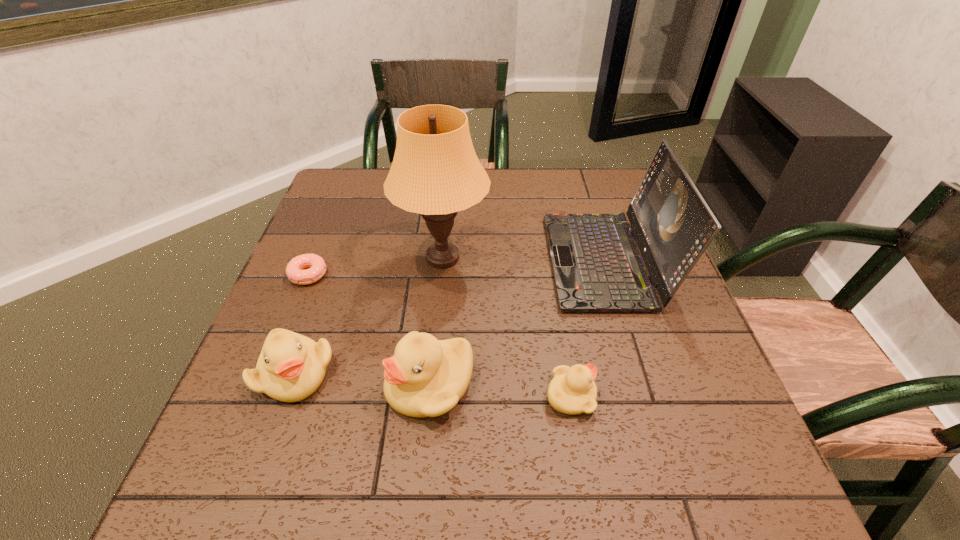
Identify the location of object that is at the near left corner. Image resolution: width=960 pixels, height=540 pixels. (291, 367).

This screenshot has width=960, height=540. In the image, there is a desktop. Find the location of `vacant space at the far edge`. vacant space at the far edge is located at coordinates (575, 183).

Locate an element on the screen. This screenshot has width=960, height=540. free space at the left edge is located at coordinates (360, 228).

This screenshot has width=960, height=540. Find the location of `vacant space at the right edge`. vacant space at the right edge is located at coordinates (663, 357).

Where is `vacant point at the far left corner`? vacant point at the far left corner is located at coordinates (371, 183).

The image size is (960, 540). Find the location of `free region at the near left corner`. free region at the near left corner is located at coordinates (283, 429).

You are a GUI agent. You are given a task and a screenshot of the screen. Output one action in this format:
    pyautogui.click(x=<x>, y=<y>)
    Task: Click on the free space that is in between the second tallest duckling and the second duckling from right to left
    
    Given the screenshot: What is the action you would take?
    pyautogui.click(x=363, y=379)

Identify the location of empty space between the second duckling from right to left and the lampshade. The height and width of the screenshot is (540, 960). (437, 321).

Where is `vacant area that lies between the shortest object and the laptop computer`? The image size is (960, 540). vacant area that lies between the shortest object and the laptop computer is located at coordinates (457, 268).

Find the location of a particular element. free space between the second tallest duckling and the second duckling from left to right is located at coordinates (363, 379).